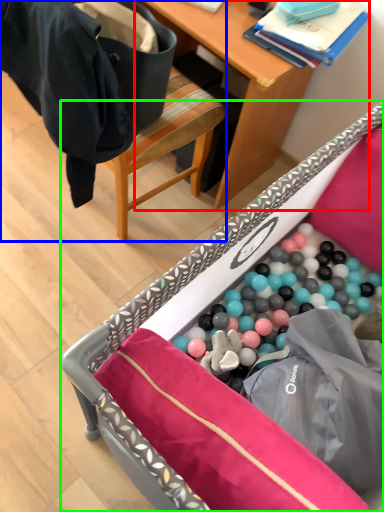
Question: Which is nearer to the desk (highlighted by a red box)? chair (highlighted by a blue box) or furniture (highlighted by a green box).

Choices:
 (A) chair
 (B) furniture

Answer: (A)